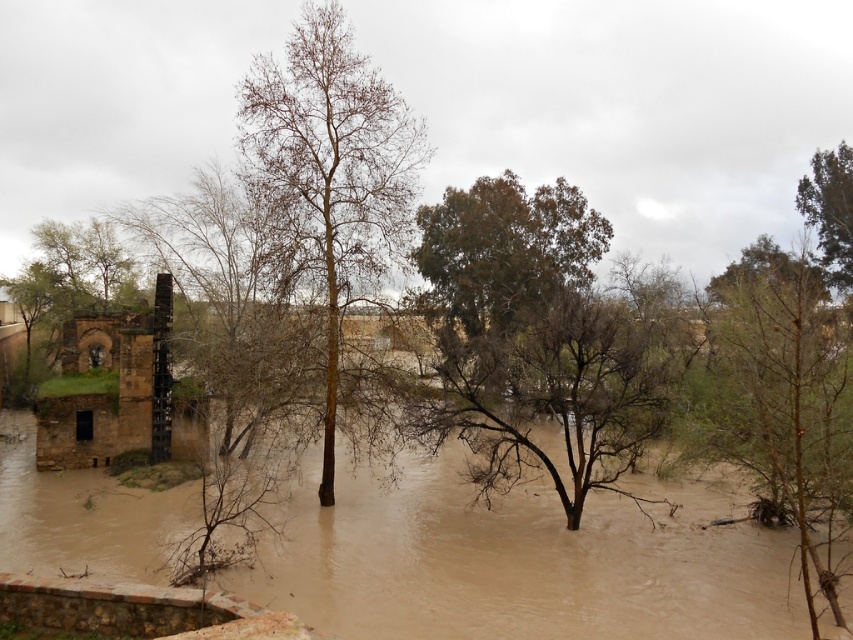
You are a rescue drone operator trying to navigate through the flooded area. You need to reach a stranded person near the old stone building on the left. Your drone has a limited flight path and must avoid flying over the bare wood tree at center. Given the coordinates provided, can you determine the safest path to the old stone building on the left without passing over the tree?

The bare wood tree at center is located at point (332,170). To avoid flying over it, the safest path would be to navigate around the tree either to the left or right of its coordinates while heading towards the old stone building on the left.

You are a hiker trying to cross the flooded area. You see the green leafy tree at center and the green leafy tree at upper right. Which tree is wider, and would that help you choose a path closer to it for stability?

The green leafy tree at center is wider than the green leafy tree at upper right. A wider tree might provide more stability, so choosing a path closer to the green leafy tree at center could be better for crossing the flooded area.